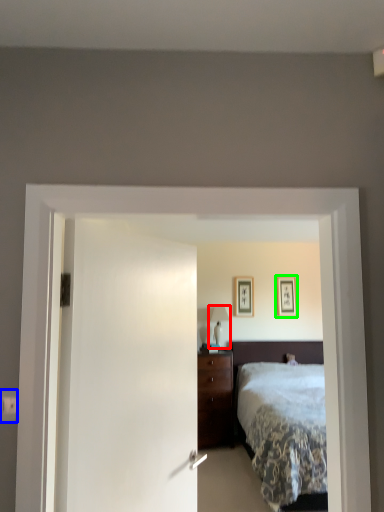
Question: Based on their relative distances, which object is nearer to table lamp (highlighted by a red box)? Choose from electric outlet (highlighted by a blue box) and picture frame (highlighted by a green box).

Choices:
 (A) electric outlet
 (B) picture frame

Answer: (B)